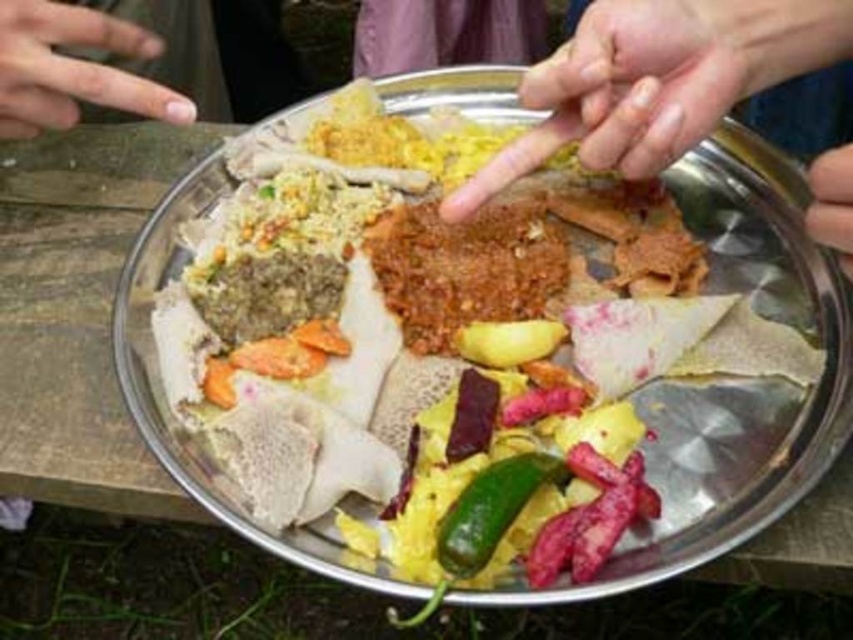
Question: Which of the following is the farthest from the observer?

Choices:
 (A) smooth skin at center
 (B) green matte pepper at center
 (C) smooth skin hand at upper right

Answer: (C)

Question: Does shiny metallic plate at center have a smaller size compared to nail polish at upper left?

Choices:
 (A) no
 (B) yes

Answer: (A)

Question: Does green matte pepper at center appear on the right side of smooth skin at center?

Choices:
 (A) no
 (B) yes

Answer: (A)

Question: Is shiny metallic plate at center thinner than smooth skin at center?

Choices:
 (A) no
 (B) yes

Answer: (A)

Question: Which of the following is the closest to the observer?

Choices:
 (A) green matte pepper at center
 (B) smooth skin at center
 (C) shiny metallic plate at center
 (D) smooth skin hand at upper right

Answer: (A)

Question: Which object is positioned farthest from the smooth skin at center?

Choices:
 (A) smooth skin hand at upper right
 (B) green matte pepper at center

Answer: (B)